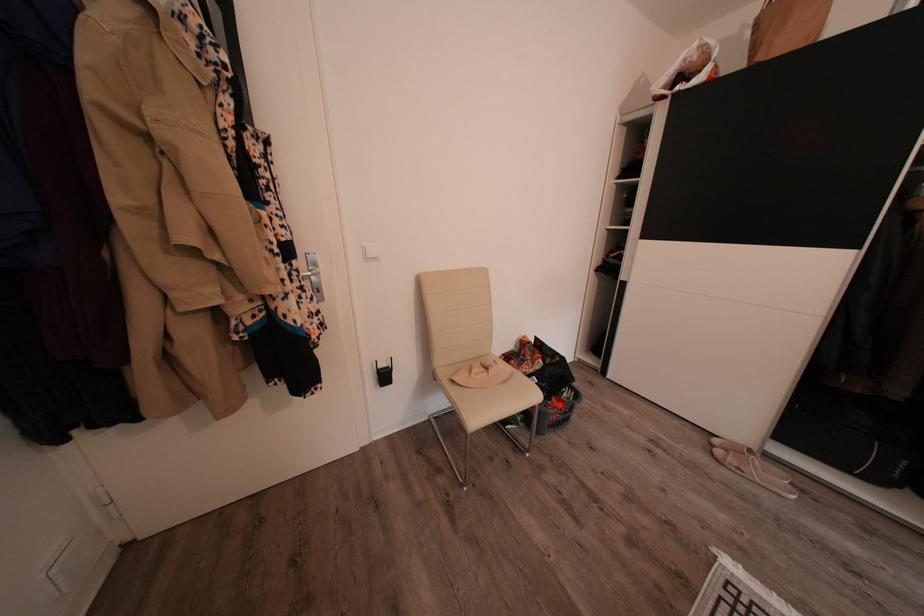
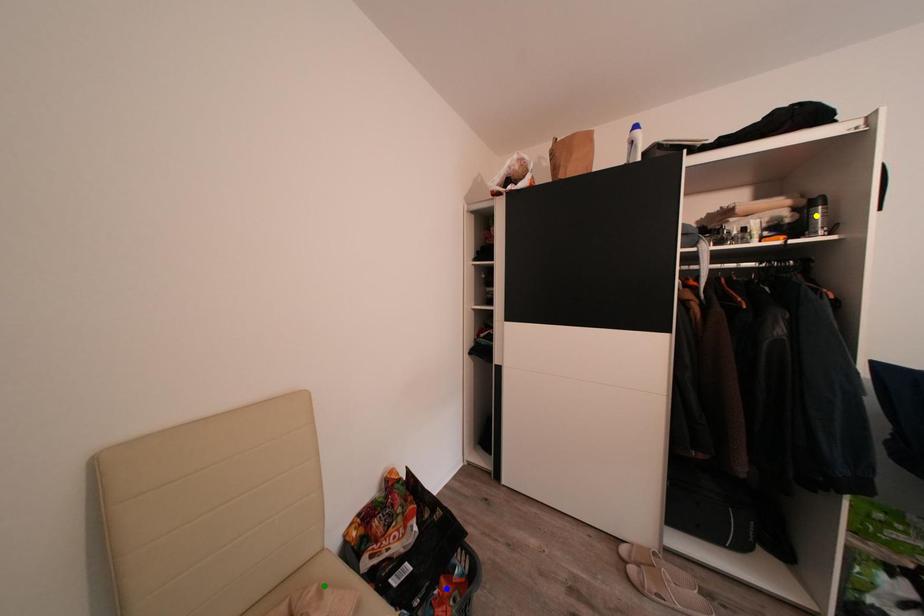
Question: I am providing you with two images of the same scene from different viewpoints. A red point is marked on the first image. You are given multiple points on the second image. In image 2, which mark is for the same physical point as the one in image 1?

Choices:
 (A) yellow point
 (B) green point
 (C) blue point

Answer: (C)